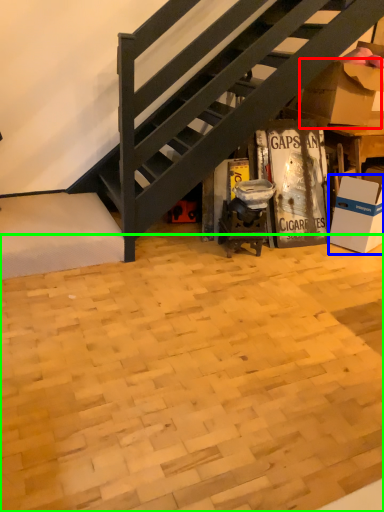
Question: Which object is positioned closest to cardboard box (highlighted by a red box)? Select from box (highlighted by a blue box) and plywood (highlighted by a green box).

Choices:
 (A) box
 (B) plywood

Answer: (A)